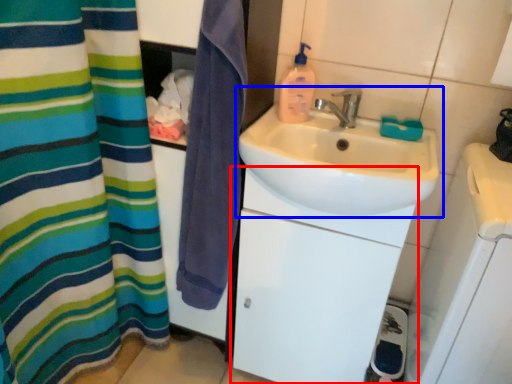
Question: Which object appears farthest to the camera in this image, bathroom cabinet (highlighted by a red box) or sink (highlighted by a blue box)?

Choices:
 (A) bathroom cabinet
 (B) sink

Answer: (A)